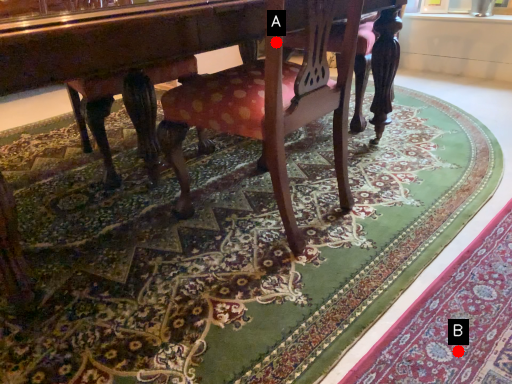
Question: Two points are circled on the image, labeled by A and B beside each circle. Which of the following is the farthest from the observer?

Choices:
 (A) A is further
 (B) B is further

Answer: (A)